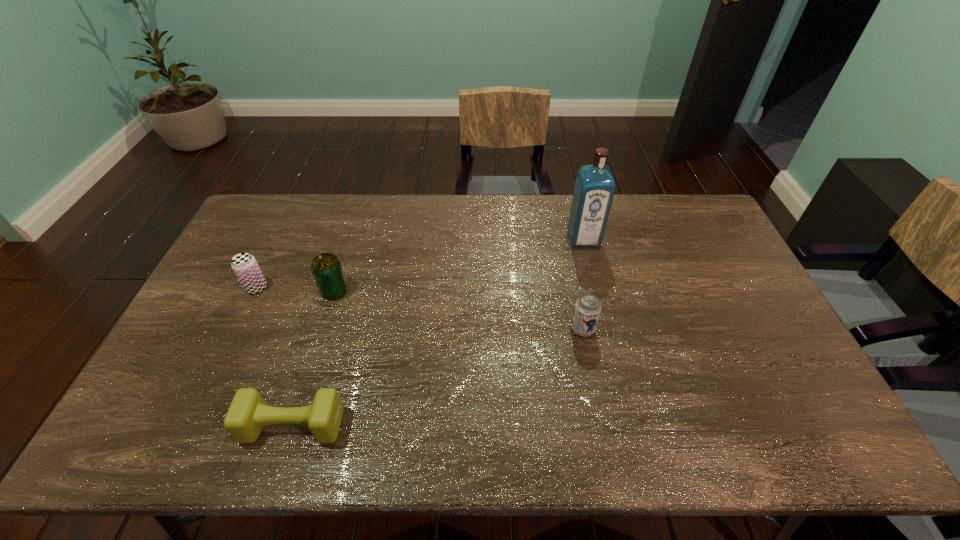
The height and width of the screenshot is (540, 960). Identify the location of blank region between the nearest beer can and the nearest object. point(438,377).

Locate an element on the screen. Image resolution: width=960 pixels, height=540 pixels. object that can be found as the third closest to the nearest object is located at coordinates (587, 310).

Locate an element on the screen. Image resolution: width=960 pixels, height=540 pixels. the second closest object to the dumbbell is located at coordinates (244, 265).

Select which beer can appears as the second closest to the leftmost object. Please provide its 2D coordinates. Your answer should be formatted as a tuple, i.e. [(x, y)], where the tuple contains the x and y coordinates of a point satisfying the conditions above.

[(587, 310)]

You are a GUI agent. You are given a task and a screenshot of the screen. Output one action in this format:
    pyautogui.click(x=<x>, y=<y>)
    Task: Click on the beer can that is the second closest to the leftmost beer can
    This screenshot has height=540, width=960.
    Given the screenshot: What is the action you would take?
    pyautogui.click(x=587, y=310)